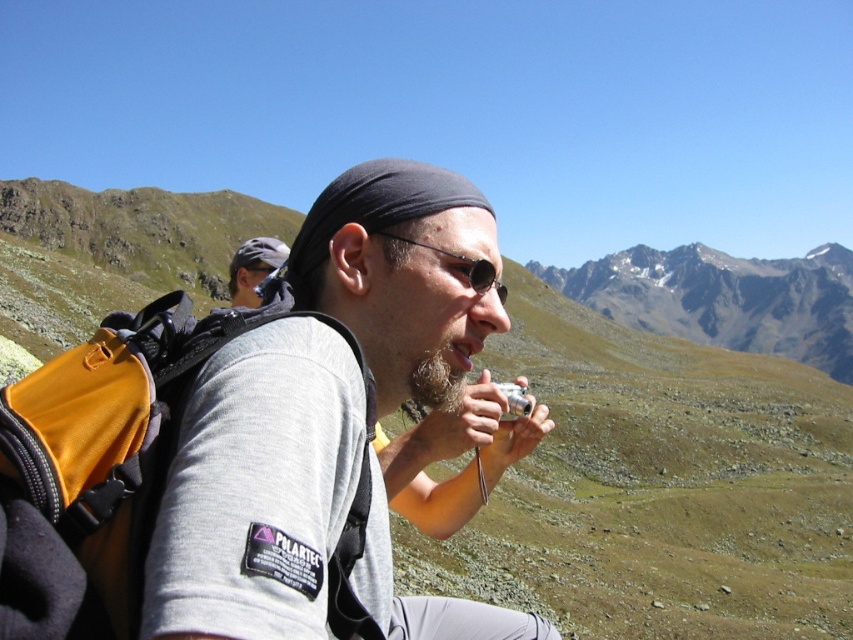
You are a photographer trying to capture a clear shot of the gray fabric shirt at center and the yellow fabric backpack at left. Which object should you focus on first to ensure it appears sharp in the photo?

The gray fabric shirt at center is closer to the viewer than the yellow fabric backpack at left, so focusing on the gray fabric shirt at center first will ensure it appears sharp. The yellow fabric backpack at left is farther away and may appear slightly out of focus if not adjusted properly.

You are standing at the point with coordinates point (229,280) and want to move towards the point (822,289). Based on the spatial relationship between these two points, will you be moving closer to or farther away from the viewer?

Point (822,289) is further to the viewer than point (229,280). So moving from point (229,280) towards point (822,289) means you are moving closer to the viewer.